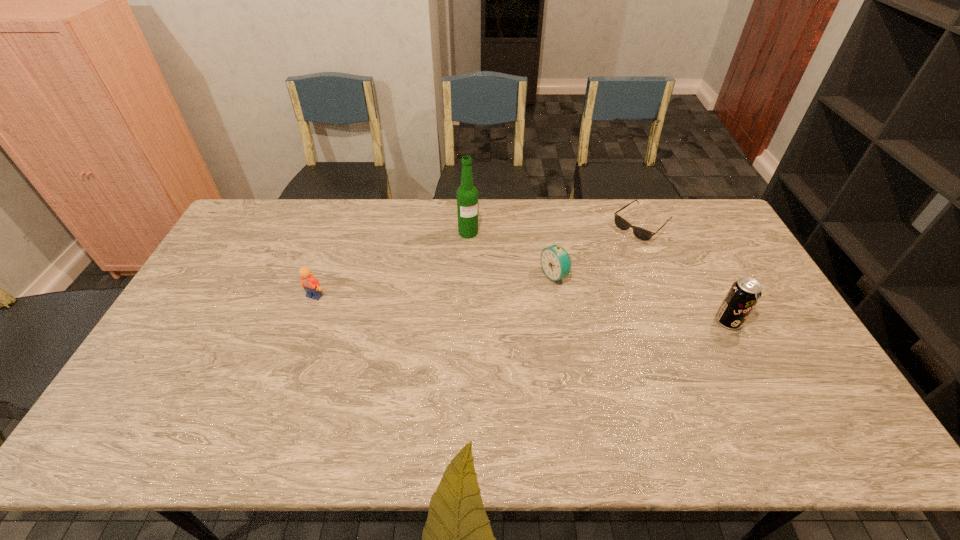
Locate an element on the screen. This screenshot has height=540, width=960. the closest object to the shortest object is located at coordinates (555, 261).

Locate an element on the screen. vacant space that satisfies the following two spatial constraints: 1. on the back side of the sunglasses; 2. on the right side of the alarm clock is located at coordinates (545, 225).

Find the location of a particular element. This screenshot has height=540, width=960. free region that satisfies the following two spatial constraints: 1. on the front side of the tallest object; 2. on the left side of the nearest object is located at coordinates (466, 321).